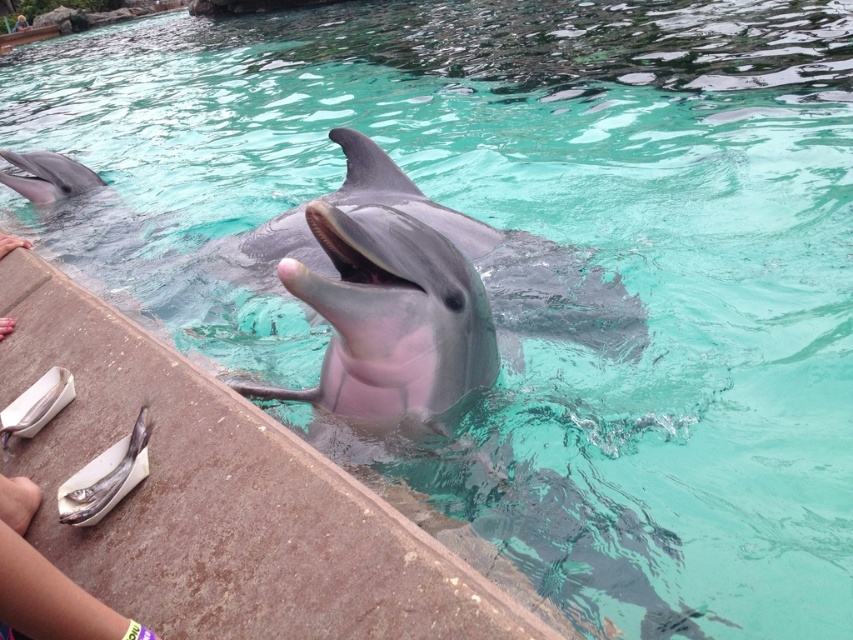
Question: Can you confirm if skinny fish at lower left is positioned below shiny silver fish at lower left?

Choices:
 (A) yes
 (B) no

Answer: (A)

Question: Does skinny fish at lower left appear on the left side of shiny silver fish at lower left?

Choices:
 (A) no
 (B) yes

Answer: (A)

Question: Is skinny fish at lower left closer to the viewer compared to shiny silver fish at lower left?

Choices:
 (A) no
 (B) yes

Answer: (B)

Question: Which object appears closest to the camera in this image?

Choices:
 (A) skinny fish at lower left
 (B) shiny silver fish at lower left

Answer: (A)

Question: Which object is the farthest from the shiny silver fish at lower left?

Choices:
 (A) skinny fish at lower left
 (B) smooth gray dolphin at center

Answer: (B)

Question: Which point is farther to the camera?

Choices:
 (A) shiny silver fish at lower left
 (B) skinny fish at lower left
 (C) smooth gray dolphin at center

Answer: (C)